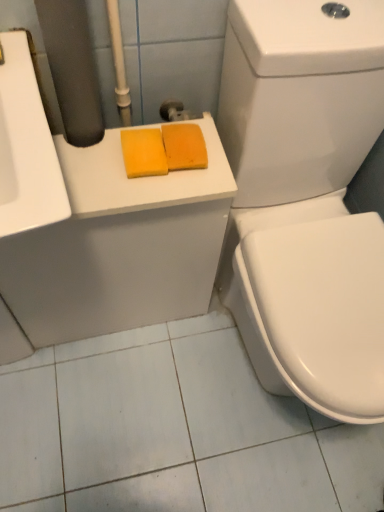
Locate an element on the screen. Image resolution: width=384 pixels, height=512 pixels. vacant area in front of orange sponge at upper center, acting as the second soap starting from the left is located at coordinates pos(171,189).